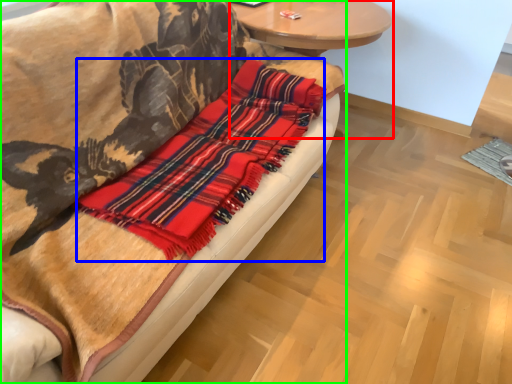
Question: Based on their relative distances, which object is nearer to round table (highlighted by a red box)? Choose from flannel (highlighted by a blue box) and studio couch (highlighted by a green box).

Choices:
 (A) flannel
 (B) studio couch

Answer: (A)